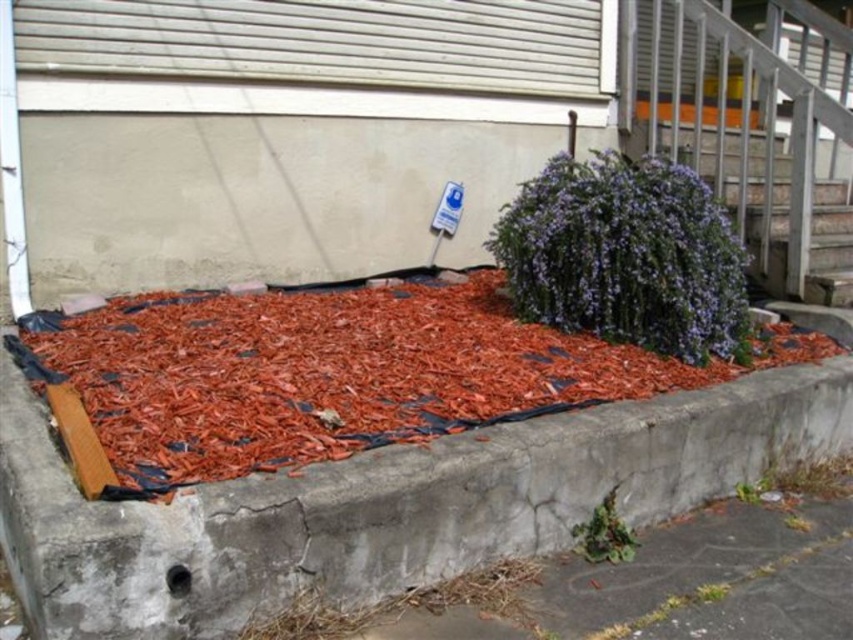
You are a gardener assessing the landscaping. You notice the red mulch at center and the wooden at upper right. Which object is taller?

The wooden at upper right is taller than the red mulch at center.

You are standing in front of the landscaped area and want to take a photo. You notice two points marked in the scene. Which point, point (844,282) or point (619,547), is closer to your camera lens?

Point (619,547) is closer to the camera lens because it is less further than point (844,282).

Based on the coordinates provided in the description, where is the purple matte bush at center located?

The purple matte bush at center is located at point (x=625, y=257).